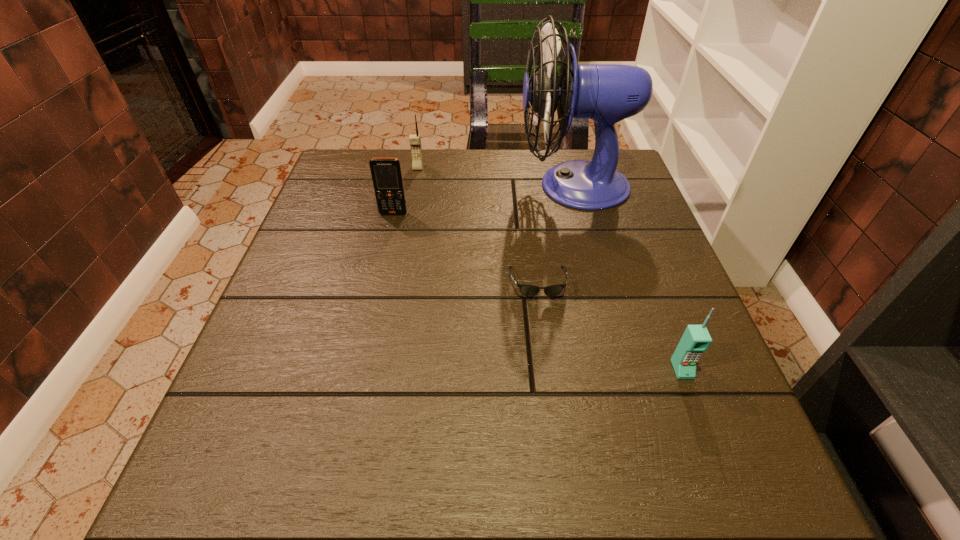
What are the coordinates of `vacant area located on the front of the farthest cellular telephone, where the keypad is located` in the screenshot? It's located at (403, 248).

Find the location of a particular element. This screenshot has width=960, height=540. vacant space positioned on the screen of the second nearest cellular telephone is located at coordinates (387, 242).

Where is `vacant space positioned on the keypad of the rightmost cellular telephone`? This screenshot has width=960, height=540. vacant space positioned on the keypad of the rightmost cellular telephone is located at coordinates (696, 406).

The width and height of the screenshot is (960, 540). I want to click on vacant area situated on the front-facing side of the sunglasses, so click(x=555, y=416).

The height and width of the screenshot is (540, 960). What are the coordinates of `fan located at the far edge` in the screenshot? It's located at (606, 93).

Where is `cellular telephone at the far edge`? The width and height of the screenshot is (960, 540). cellular telephone at the far edge is located at coordinates (414, 139).

Where is `fan that is at the right edge`? This screenshot has width=960, height=540. fan that is at the right edge is located at coordinates (606, 93).

In order to click on cellular telephone that is positioned at the right edge in this screenshot , I will do `click(696, 339)`.

This screenshot has width=960, height=540. What are the coordinates of `object that is positioned at the far right corner` in the screenshot? It's located at (606, 93).

In the image, there is a desktop. Identify the location of vacant space at the far edge. This screenshot has width=960, height=540. (436, 155).